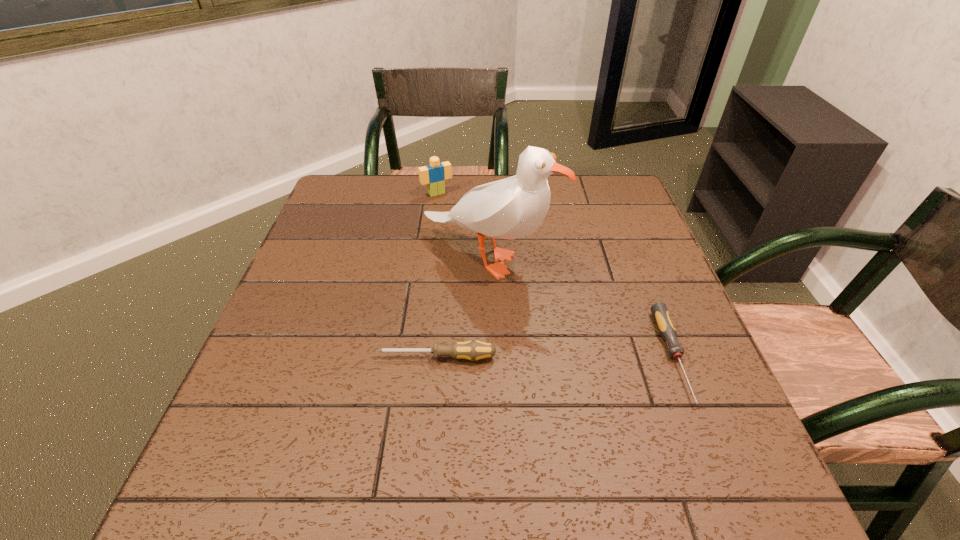
The height and width of the screenshot is (540, 960). What are the coordinates of `object positioned at the near right corner` in the screenshot? It's located at (665, 325).

Locate an element on the screen. vacant space at the far edge of the desktop is located at coordinates (436, 200).

You are a GUI agent. You are given a task and a screenshot of the screen. Output one action in this format:
    pyautogui.click(x=<x>, y=<y>)
    Task: Click on the vacant space at the near edge of the desktop
    
    Given the screenshot: What is the action you would take?
    pyautogui.click(x=615, y=424)

Find the location of `vacant space at the left edge of the desktop`. vacant space at the left edge of the desktop is located at coordinates 303,269.

This screenshot has width=960, height=540. I want to click on free location at the right edge of the desktop, so click(x=631, y=265).

This screenshot has height=540, width=960. In the image, there is a desktop. Find the location of `vacant space at the far left corner`. vacant space at the far left corner is located at coordinates (353, 190).

This screenshot has width=960, height=540. Find the location of `vacant region at the far right corner of the desktop`. vacant region at the far right corner of the desktop is located at coordinates (595, 184).

Image resolution: width=960 pixels, height=540 pixels. I want to click on vacant area at the near right corner, so click(x=711, y=415).

I want to click on free space that is in between the rightmost object and the gull, so click(x=581, y=307).

This screenshot has width=960, height=540. I want to click on blank region between the third shortest object and the shortest object, so click(x=555, y=275).